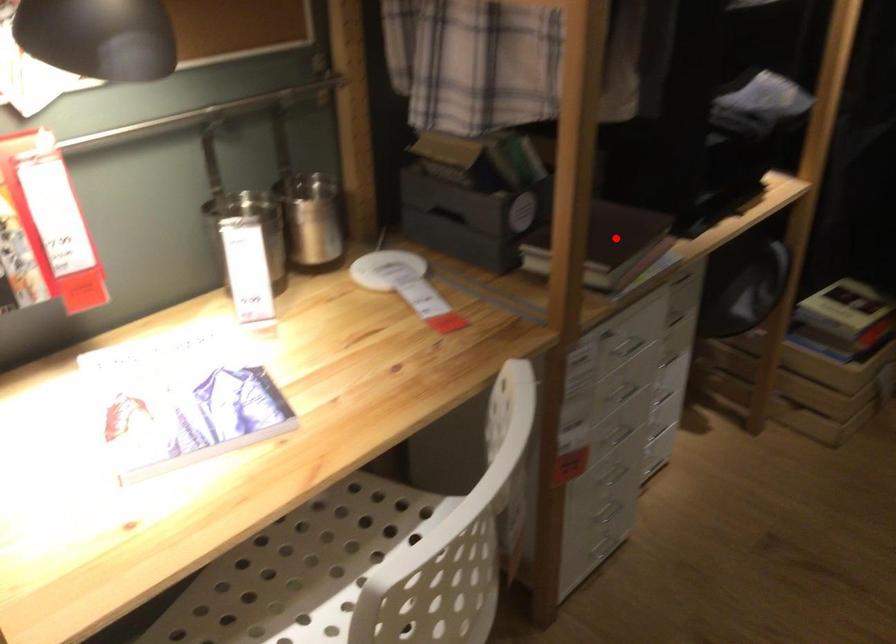
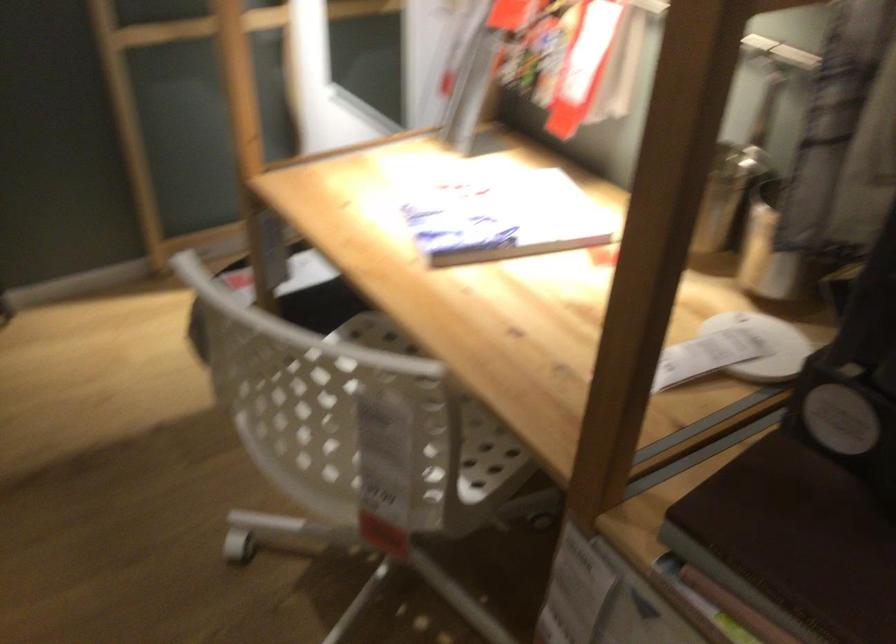
Question: I am providing you with two images of the same scene from different viewpoints. A red point is shown in image1. For the corresponding object point in image2, is it positioned nearer or farther from the camera?

Choices:
 (A) Nearer
 (B) Farther

Answer: (A)